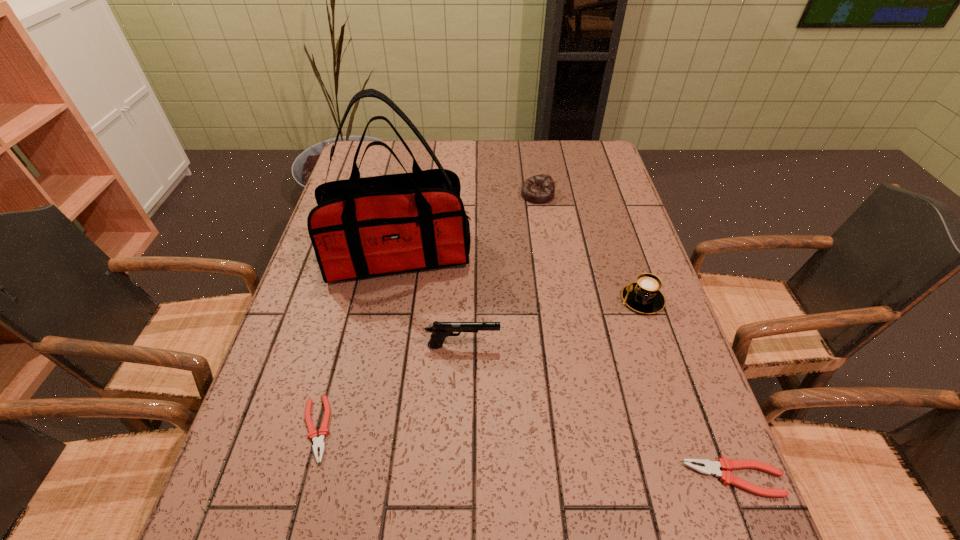
The width and height of the screenshot is (960, 540). Find the location of `vacant space that is in between the shorter pliers and the taller pliers`. vacant space that is in between the shorter pliers and the taller pliers is located at coordinates (525, 453).

The width and height of the screenshot is (960, 540). In order to click on vacant space in between the gun and the beanbag in this screenshot , I will do `click(500, 270)`.

The width and height of the screenshot is (960, 540). I want to click on free space between the second tallest object and the cappuccino, so click(553, 323).

Find the location of `free space between the fifth tallest object and the cappuccino`. free space between the fifth tallest object and the cappuccino is located at coordinates (688, 389).

Locate an element on the screen. empty space between the cappuccino and the duffel bag is located at coordinates (520, 278).

Identify the location of unoccupied area between the duffel bag and the taller pliers. (566, 367).

Find the location of a particular element. This screenshot has height=540, width=960. object that is the third closest to the third shortest object is located at coordinates (440, 330).

Locate which object ranks third in proximity to the duffel bag. Please provide its 2D coordinates. Your answer should be formatted as a tuple, i.e. [(x, y)], where the tuple contains the x and y coordinates of a point satisfying the conditions above.

[(318, 442)]

In order to click on vacant region that satisfies the following two spatial constraints: 1. at the aiming end of the second shortest object; 2. on the left side of the fifth shortest object in this screenshot , I will do `click(459, 478)`.

This screenshot has width=960, height=540. I want to click on free space that satisfies the following two spatial constraints: 1. at the aiming end of the gun; 2. on the left side of the right pliers, so click(459, 478).